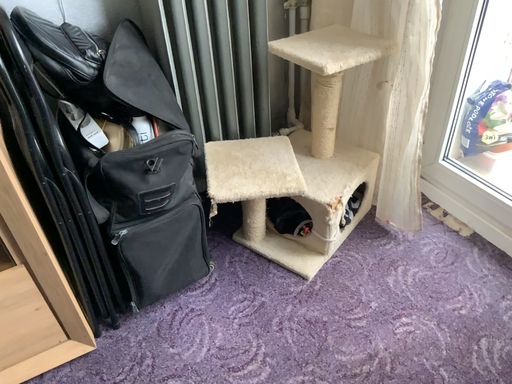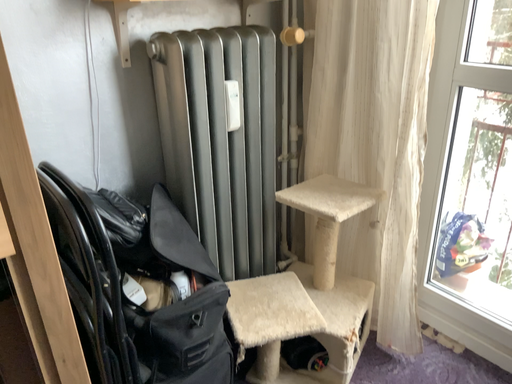
Question: Which way did the camera rotate in the video?

Choices:
 (A) rotated right
 (B) rotated left

Answer: (A)